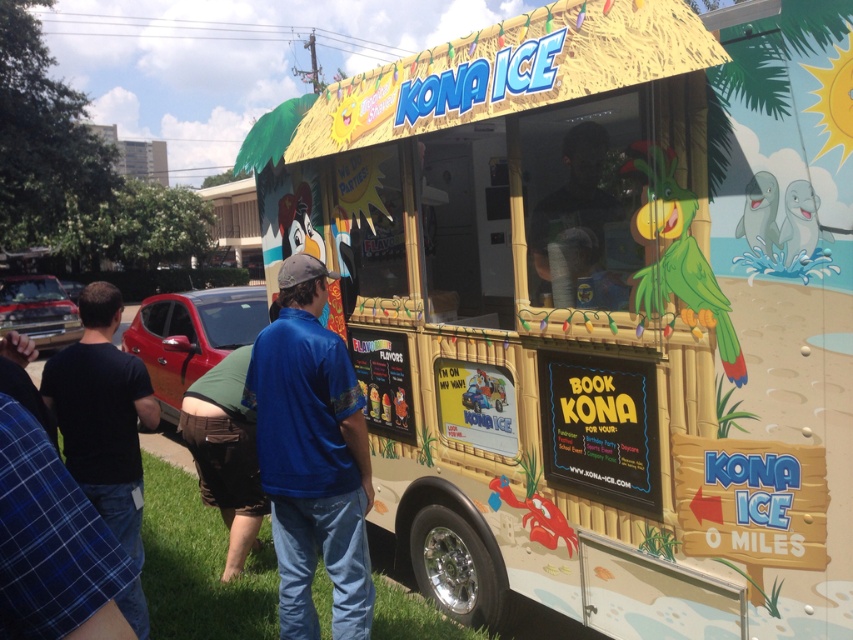
You are a customer at the Kona Ice food truck and want to know where your black cotton shirt is located. Based on the image provided, can you tell me the exact coordinates of the black cotton shirt at lower left?

The black cotton shirt at lower left is located at point coordinates of (103, 413).

Looking at this image, you are a customer at the Kona Ice truck and want to choose between the black cotton shirt at lower left and the matte black shirt at center. Which one is bigger?

The black cotton shirt at lower left is larger in size than the matte black shirt at center.

You are a customer standing in front of the beige bamboo food truck at center and the black cotton shirt at lower left. Which object is closer to you?

The beige bamboo food truck at center is closer to you because it is further to the viewer than the black cotton shirt at lower left.